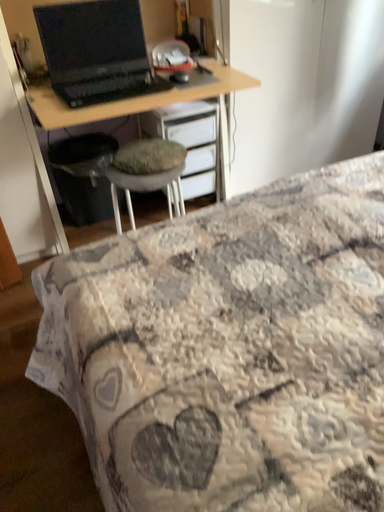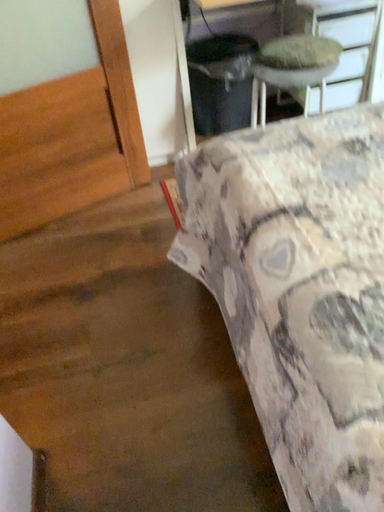
Question: How did the camera likely rotate when shooting the video?

Choices:
 (A) rotated left
 (B) rotated right

Answer: (A)